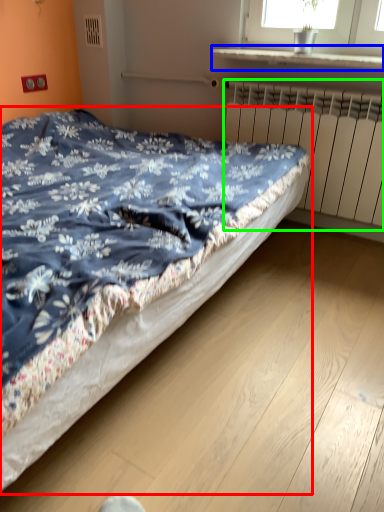
Question: Which object is positioned farthest from bed (highlighted by a red box)? Select from window sill (highlighted by a blue box) and radiator (highlighted by a green box).

Choices:
 (A) window sill
 (B) radiator

Answer: (A)